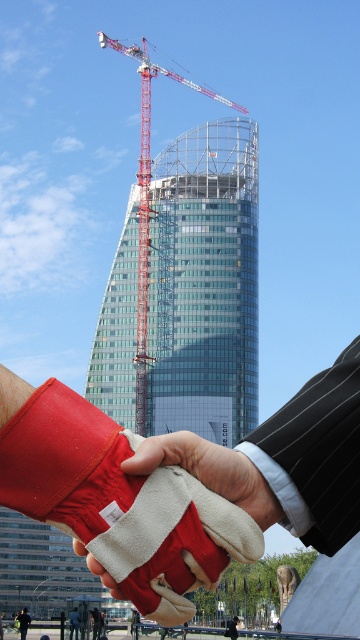
Question: Which of the following is the farthest from the observer?

Choices:
 (A) (20, 627)
 (B) (137, 179)

Answer: (B)

Question: Which point appears closest to the camera in this image?

Choices:
 (A) (273, 508)
 (B) (138, 248)

Answer: (A)

Question: Among these objects, which one is farthest from the camera?

Choices:
 (A) red leather glove at center
 (B) red leather glove at lower left

Answer: (B)

Question: Is red leather glove at center positioned in front of red leather glove at lower left?

Choices:
 (A) yes
 (B) no

Answer: (A)

Question: Considering the relative positions of red metal crane at center and red leather glove at lower left in the image provided, where is red metal crane at center located with respect to red leather glove at lower left?

Choices:
 (A) above
 (B) below

Answer: (A)

Question: Is red leather glove at center below red leather glove at lower left?

Choices:
 (A) yes
 (B) no

Answer: (B)